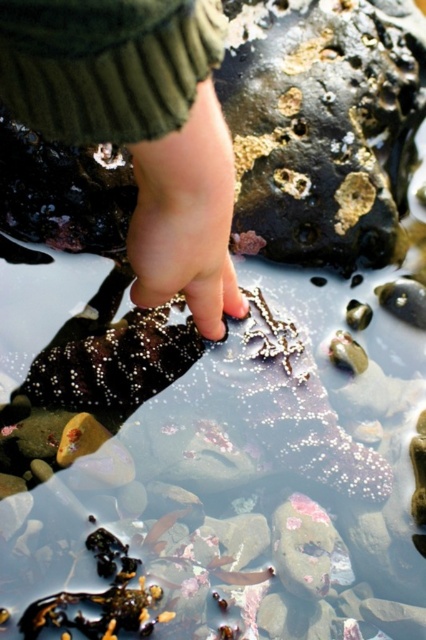
Is smooth skin hand at center to the left of skinny flesh-toned hand at center from the viewer's perspective?

No, smooth skin hand at center is not to the left of skinny flesh-toned hand at center.

Between point (123, 116) and point (219, 317), which one is positioned in front?

Positioned in front is point (123, 116).

Is point (212, 336) farther from camera compared to point (196, 120)?

That is True.

Find the location of `smooth skin hand at center`. smooth skin hand at center is located at coordinates point(140,128).